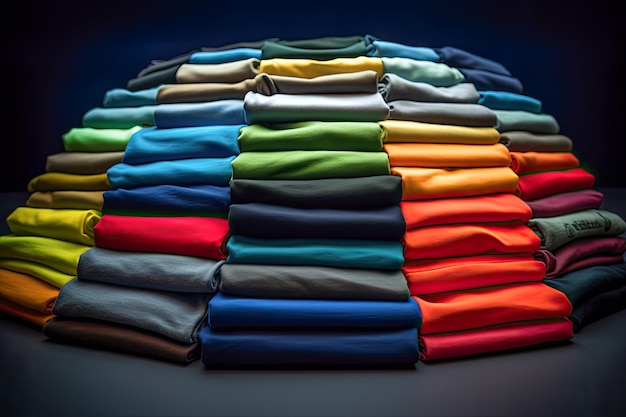
This screenshot has height=417, width=626. I want to click on red fabrics, so click(x=493, y=346), click(x=494, y=307), click(x=484, y=275), click(x=478, y=245), click(x=479, y=211), click(x=553, y=181), click(x=167, y=237).